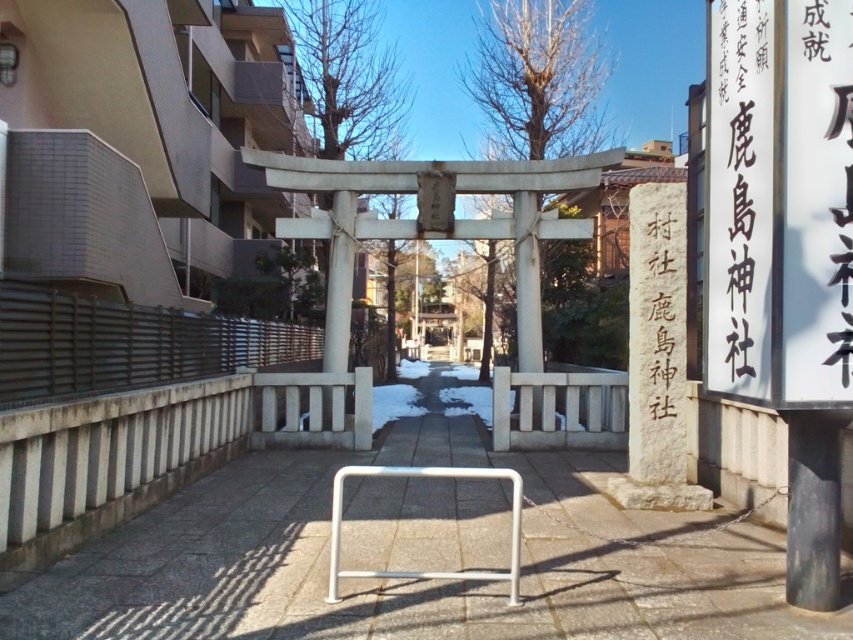
You are standing at the entrance of the shrine and want to walk towards the gray concrete pavement at center. Which direction should you head?

The gray concrete pavement at center is located at point 0.909 on the x axis and 0.478 on the y axis, so you should head towards the center of the image where the coordinates are located.

As a visitor approaching the torii gate, you notice the black stone sign at center right and the white metallic bar at center. Which object would appear bigger to you?

The black stone sign at center right is larger in size than the white metallic bar at center, so it would appear bigger to you.

You are standing at the entrance of the torii gate and want to determine the distance between the two points marked on the image. Which point is closer to you, point (292,556) or point (387,465)?

Point (292,556) is closer to the viewer than point (387,465).